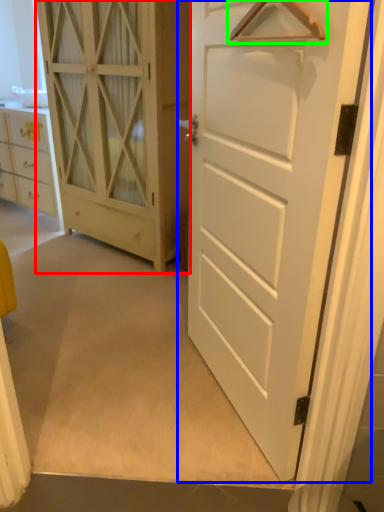
Question: Which object is positioned closest to door (highlighted by a red box)? Select from door (highlighted by a blue box) and hanger (highlighted by a green box).

Choices:
 (A) door
 (B) hanger

Answer: (A)